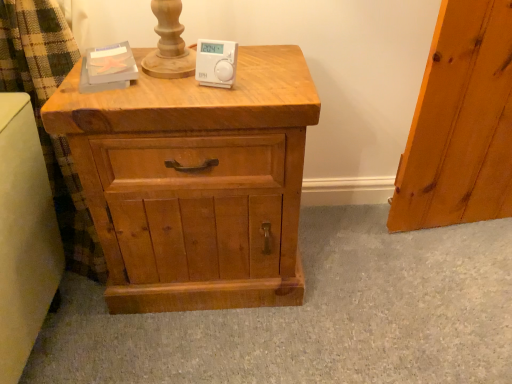
Find the location of a particular element. unoccupied region to the right of white plastic thermostat at center is located at coordinates (271, 74).